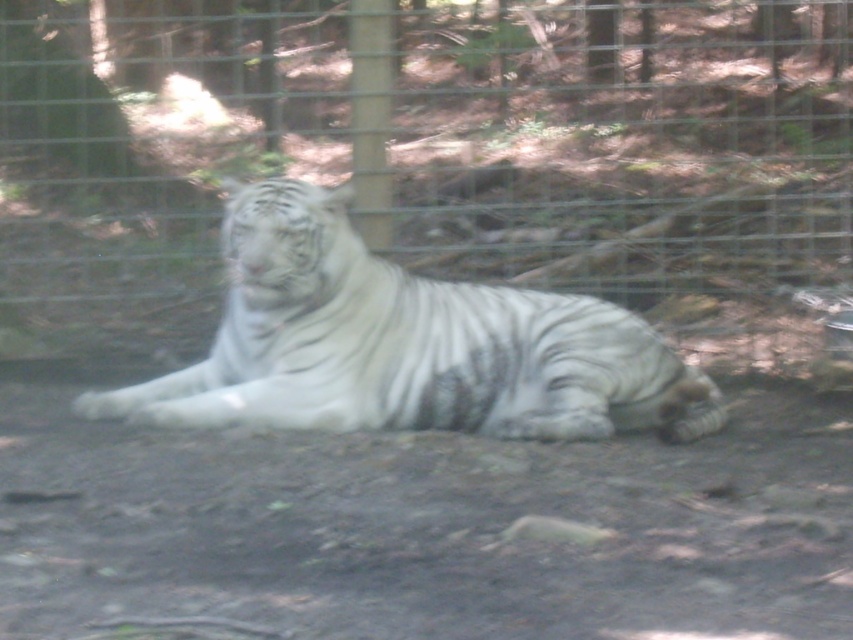
Question: Is metal wire fence at center above white striped tiger at center?

Choices:
 (A) no
 (B) yes

Answer: (B)

Question: Does metal wire fence at center have a lesser width compared to white striped tiger at center?

Choices:
 (A) no
 (B) yes

Answer: (B)

Question: Which point is closer to the camera?

Choices:
 (A) (345, 212)
 (B) (74, 196)

Answer: (A)

Question: Which point appears closest to the camera in this image?

Choices:
 (A) (805, 10)
 (B) (364, 336)

Answer: (B)

Question: Can you confirm if metal wire fence at center is positioned above white striped tiger at center?

Choices:
 (A) no
 (B) yes

Answer: (B)